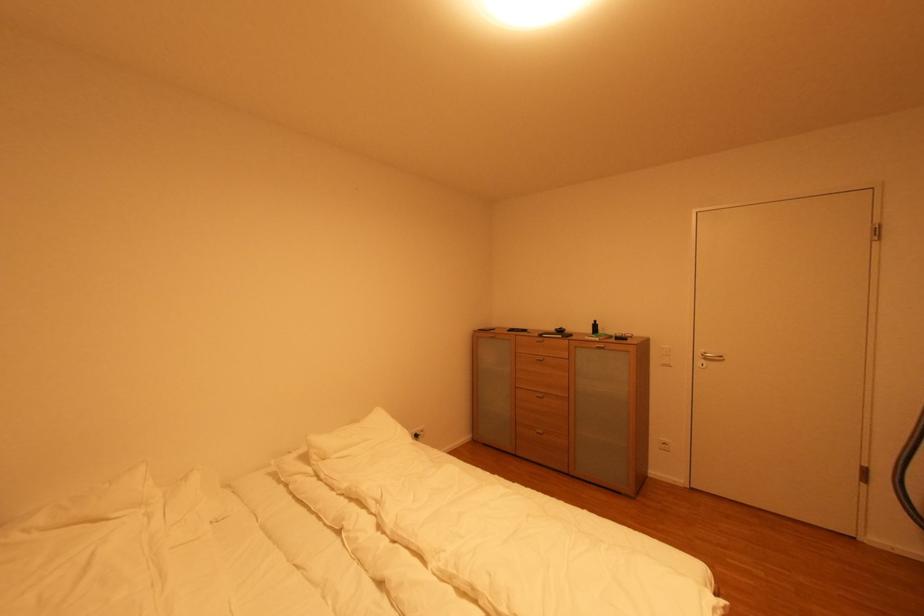
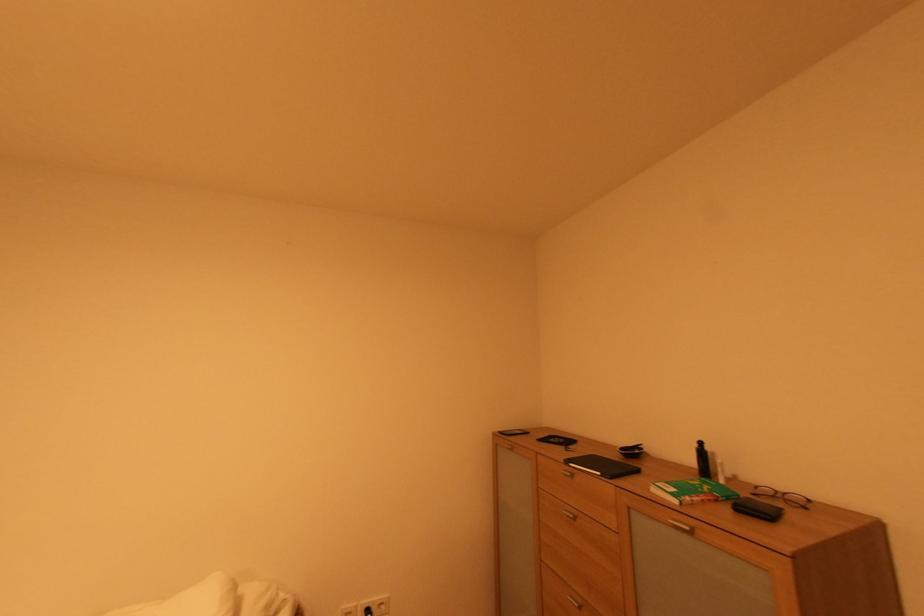
Where in the second image is the point corresponding to the point at 565,338 from the first image?

(604, 475)